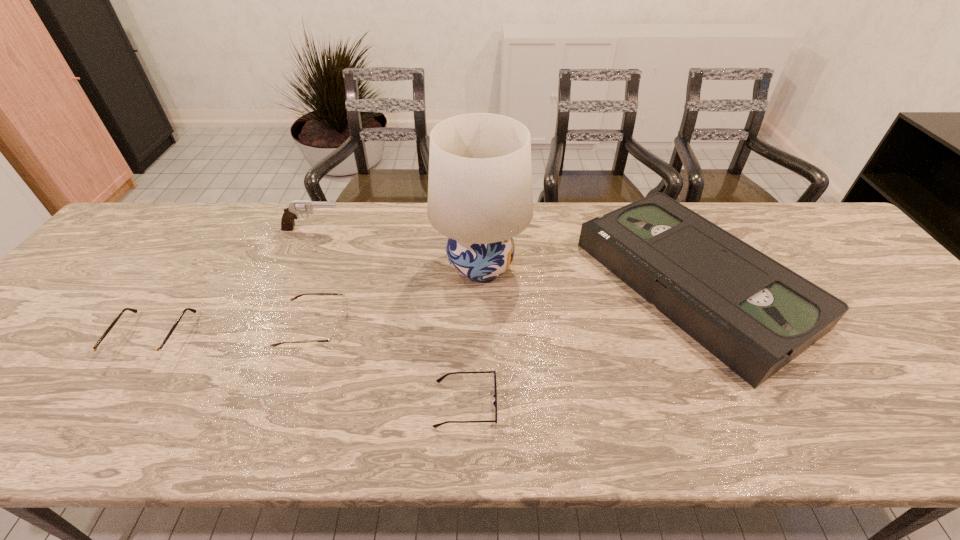
You are a GUI agent. You are given a task and a screenshot of the screen. Output one action in this format:
    pyautogui.click(x=<x>, y=<y>)
    Task: Click on the lampshade
    The image size is (960, 540).
    Given the screenshot: What is the action you would take?
    pyautogui.click(x=480, y=196)

This screenshot has width=960, height=540. Find the location of `the fifth shortest object`. the fifth shortest object is located at coordinates [x=296, y=207].

The width and height of the screenshot is (960, 540). Identify the location of videotape. (755, 315).

The height and width of the screenshot is (540, 960). Identify the location of the fourth shortest object. pos(755,315).

Where is `the leftmost object`? This screenshot has height=540, width=960. the leftmost object is located at coordinates (149, 354).

At what (x,y) coordinates should I click in order to perform the action: click on the second spectacles from right to left. Please return your answer as a coordinate pair (x, y). Looking at the image, I should click on (336, 338).

The width and height of the screenshot is (960, 540). What are the coordinates of `the rightmost spectacles` in the screenshot? It's located at (440, 379).

At what (x,y) coordinates should I click in order to perform the action: click on vacant space located 0.260m on the front-facing side of the tallest object. Please return your answer as a coordinate pair (x, y). Looking at the image, I should click on (339, 266).

I want to click on free space located 0.250m on the front-facing side of the tallest object, so click(x=343, y=266).

You are a GUI agent. You are given a task and a screenshot of the screen. Output one action in this format:
    pyautogui.click(x=<x>, y=<y>)
    Task: Click on the blank space located 0.160m on the front-facing side of the tallest object
    
    Given the screenshot: What is the action you would take?
    pyautogui.click(x=375, y=266)